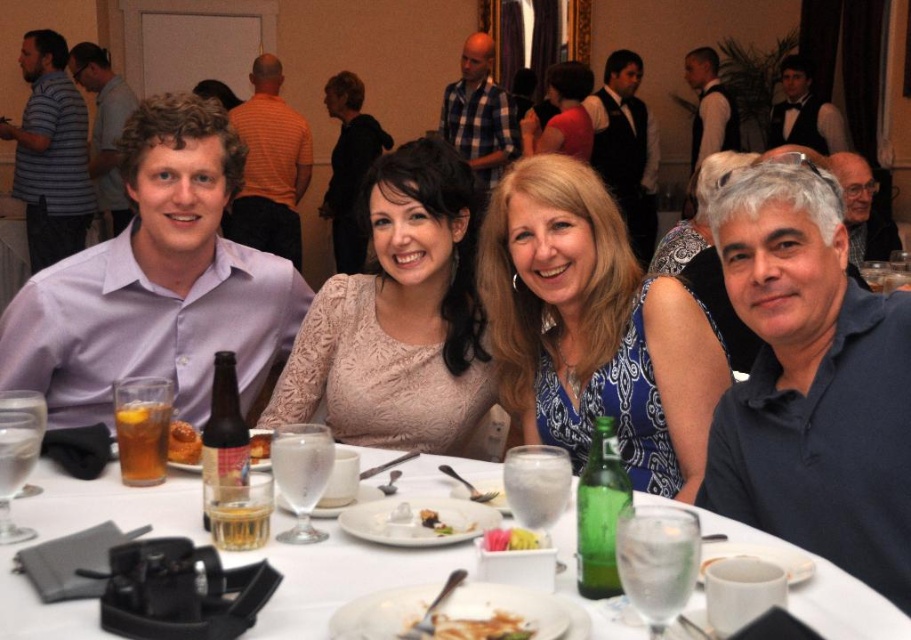
Question: Can you confirm if purple cotton shirt at left is positioned above blue patterned dress at center?

Choices:
 (A) no
 (B) yes

Answer: (B)

Question: Considering the real-world distances, which object is farthest from the lace fabric dress at center?

Choices:
 (A) green glass bottle at center
 (B) black satin bow tie at upper right

Answer: (B)

Question: Which point appears closest to the camera in this image?

Choices:
 (A) (34, 618)
 (B) (121, 227)

Answer: (A)

Question: Which point is closer to the camera?

Choices:
 (A) (178, 429)
 (B) (91, 68)
 (C) (79, 388)
 (D) (782, 61)

Answer: (A)

Question: Is black satin vest at upper center to the right of matte gray shirt at left from the viewer's perspective?

Choices:
 (A) no
 (B) yes

Answer: (B)

Question: Does purple cotton shirt at left have a larger size compared to blue patterned dress at center?

Choices:
 (A) yes
 (B) no

Answer: (A)